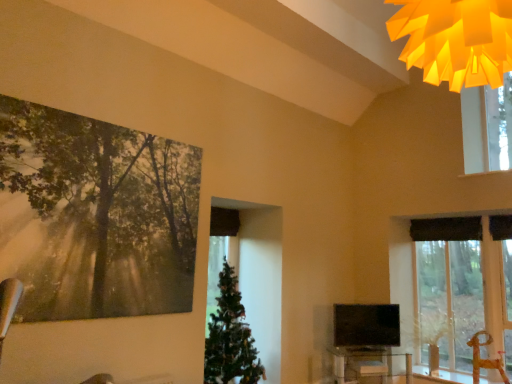
This screenshot has height=384, width=512. Identify the location of blank space above matte forest painting at upper left (from a real-world perspective). (116, 117).